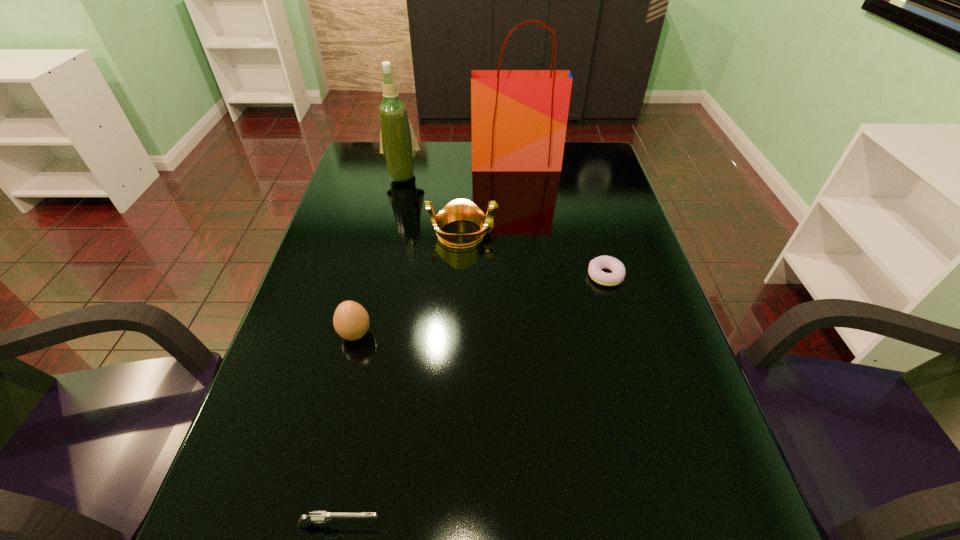
Identify the location of free location that satisfies the following two spatial constraints: 1. on the handle side of the tallest object; 2. at the front emblem of the tiara. Image resolution: width=960 pixels, height=540 pixels. (523, 233).